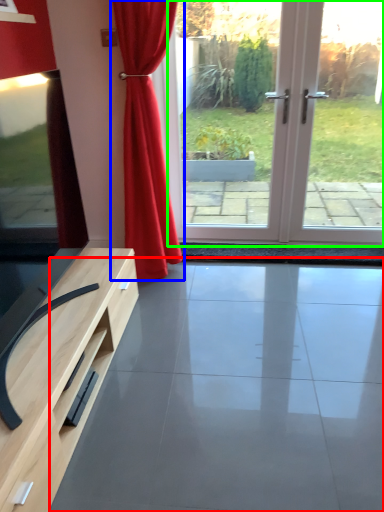
Question: Based on their relative distances, which object is farther from concrete (highlighted by a red box)? Choose from curtain (highlighted by a blue box) and screen door (highlighted by a green box).

Choices:
 (A) curtain
 (B) screen door

Answer: (B)